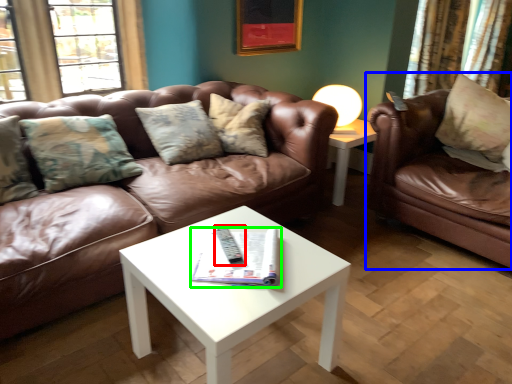
Question: Considering the real-world distances, which object is farthest from remote (highlighted by a red box)? studio couch (highlighted by a blue box) or magazine (highlighted by a green box)?

Choices:
 (A) studio couch
 (B) magazine

Answer: (A)